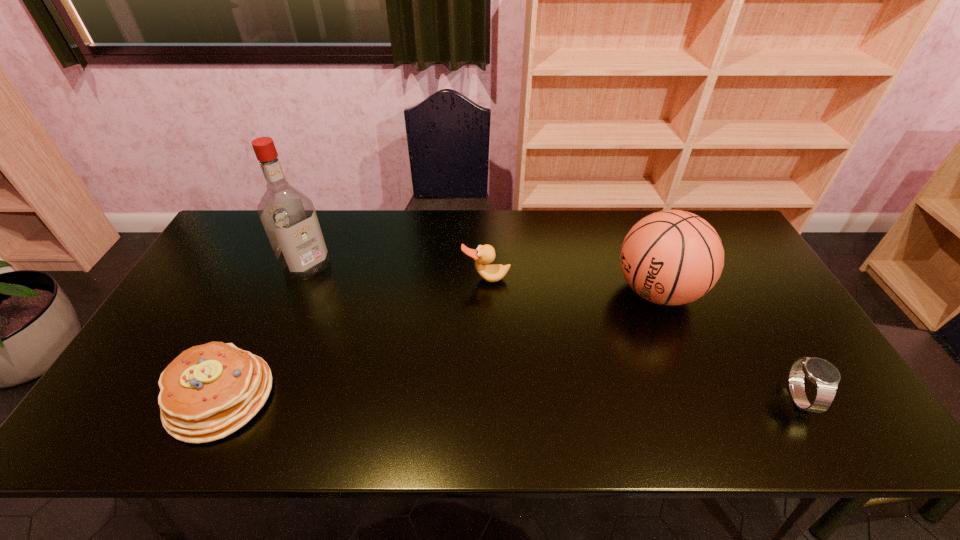
Locate an element on the screen. The width and height of the screenshot is (960, 540). vacant space that satisfies the following two spatial constraints: 1. on the front side of the fourth object from left to right; 2. on the left side of the rightmost object is located at coordinates (700, 397).

Find the location of a particular element. vacant position in the image that satisfies the following two spatial constraints: 1. on the back side of the pancake; 2. on the left side of the second tallest object is located at coordinates (272, 291).

Locate an element on the screen. The height and width of the screenshot is (540, 960). free space that satisfies the following two spatial constraints: 1. on the front side of the third object from left to right; 2. on the left side of the second object from right to left is located at coordinates (486, 291).